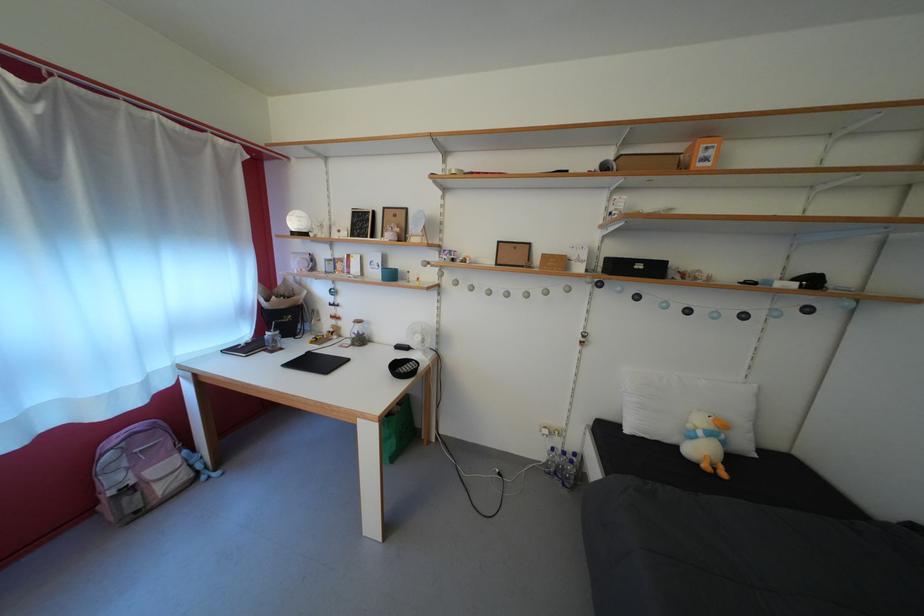
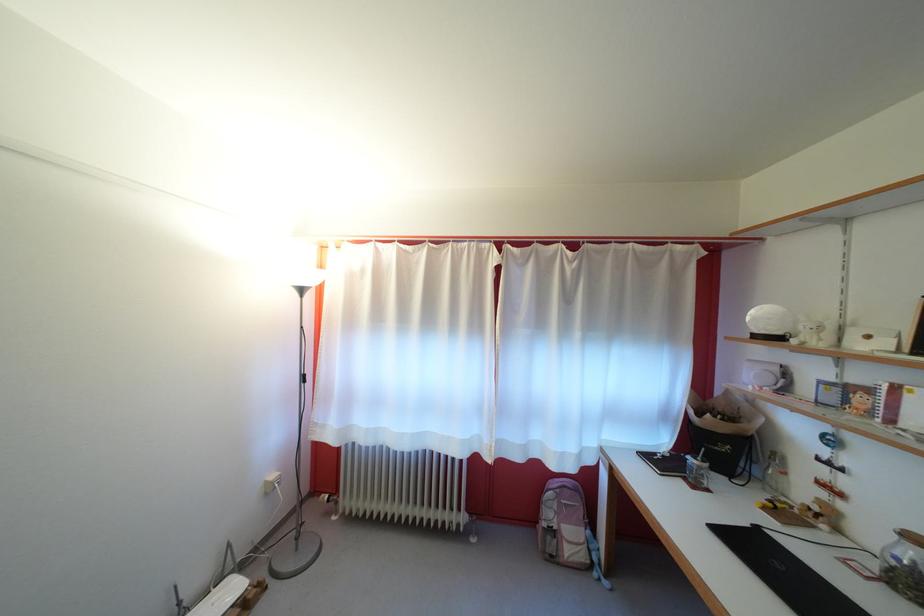
Where in the second image is the point corresponding to (x=123, y=485) from the first image?

(556, 521)